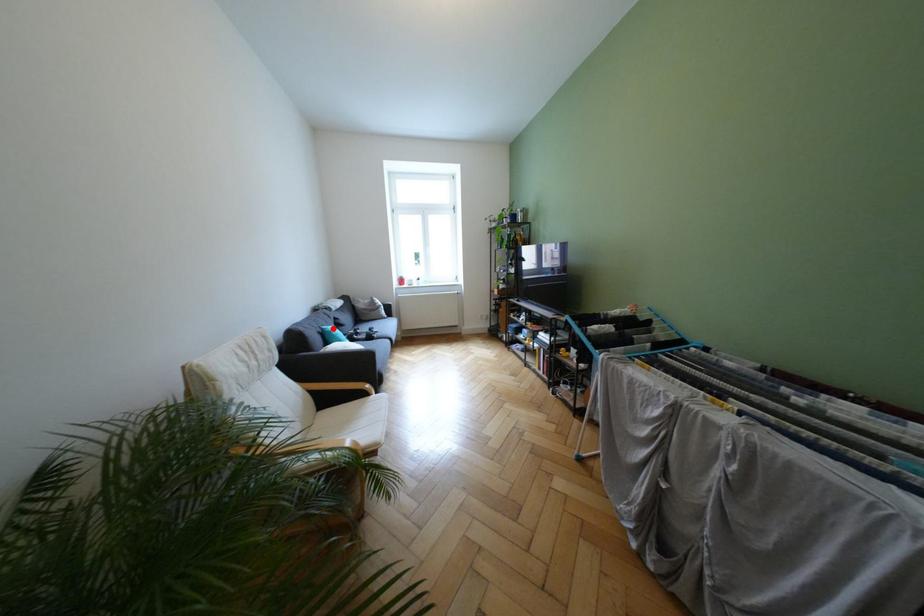
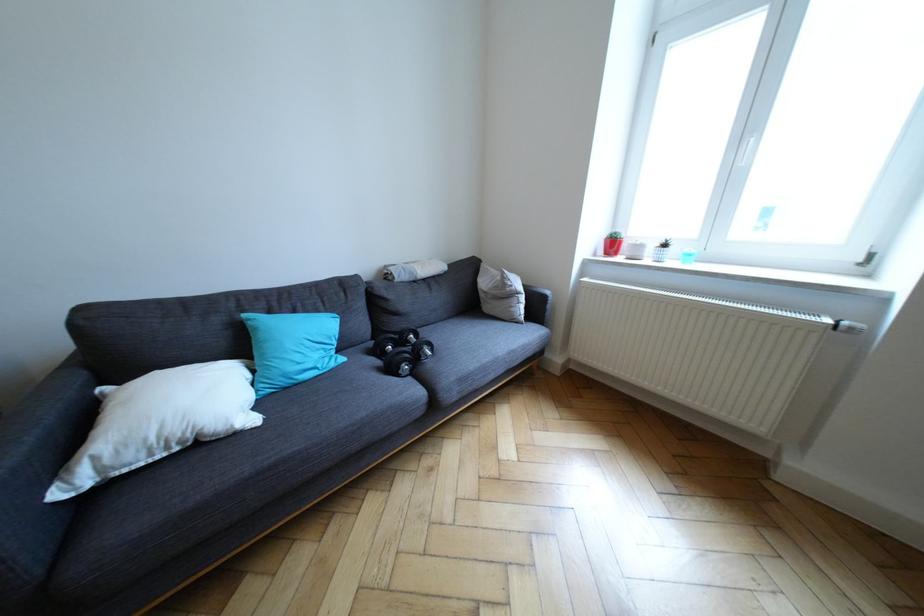
Where in the second image is the point corresponding to the highlighted location from the first image?

(254, 315)